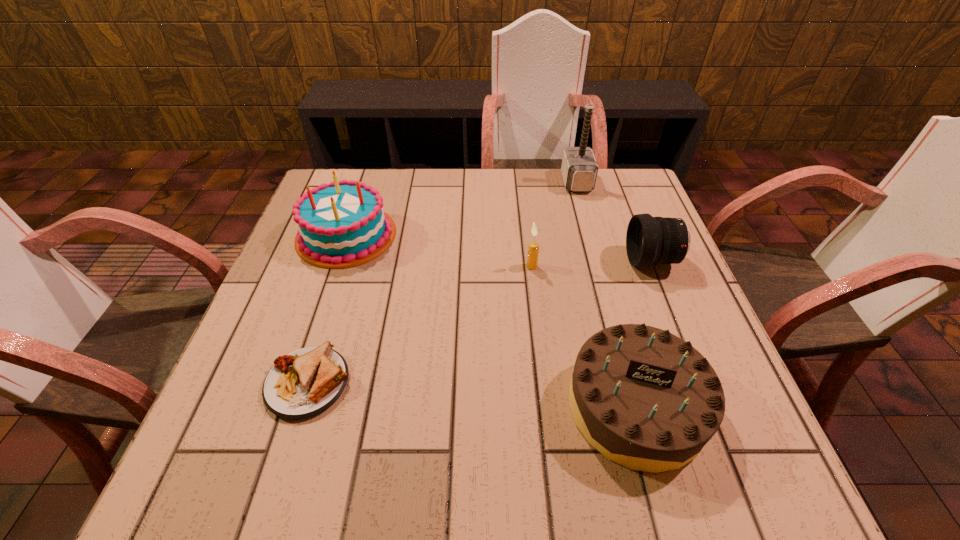
This screenshot has width=960, height=540. In order to click on the tallest object in this screenshot , I will do `click(579, 168)`.

You are a GUI agent. You are given a task and a screenshot of the screen. Output one action in this format:
    pyautogui.click(x=<x>, y=<y>)
    Task: Click on the hammer
    The height and width of the screenshot is (540, 960).
    Given the screenshot: What is the action you would take?
    pyautogui.click(x=579, y=168)

This screenshot has width=960, height=540. In order to click on the farther birthday cake in this screenshot , I will do `click(343, 224)`.

Where is `the left birthday cake`? The height and width of the screenshot is (540, 960). the left birthday cake is located at coordinates (343, 224).

Locate an element on the screen. the fourth object from right to left is located at coordinates (533, 250).

Where is `telephoto lens`? The width and height of the screenshot is (960, 540). telephoto lens is located at coordinates [650, 240].

Find the location of `the nearer birthday cake`. the nearer birthday cake is located at coordinates (646, 399).

Find the location of a particular element. The image size is (960, 540). the shorter birthday cake is located at coordinates (646, 399).

Where is `the shortest object`? Image resolution: width=960 pixels, height=540 pixels. the shortest object is located at coordinates (306, 382).

Identify the location of free space located for striking with the head of the farthest object. This screenshot has height=540, width=960. (525, 182).